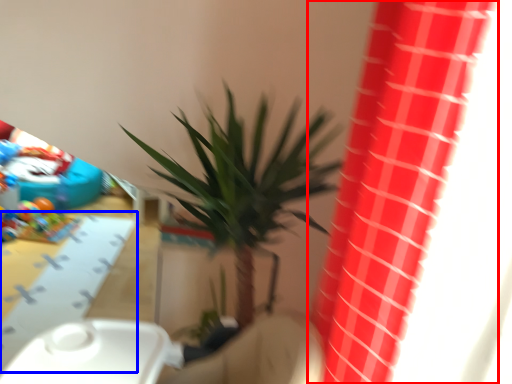
Question: Among these objects, which one is farthest to the camera, curtain (highlighted by a red box) or table (highlighted by a blue box)?

Choices:
 (A) curtain
 (B) table

Answer: (B)